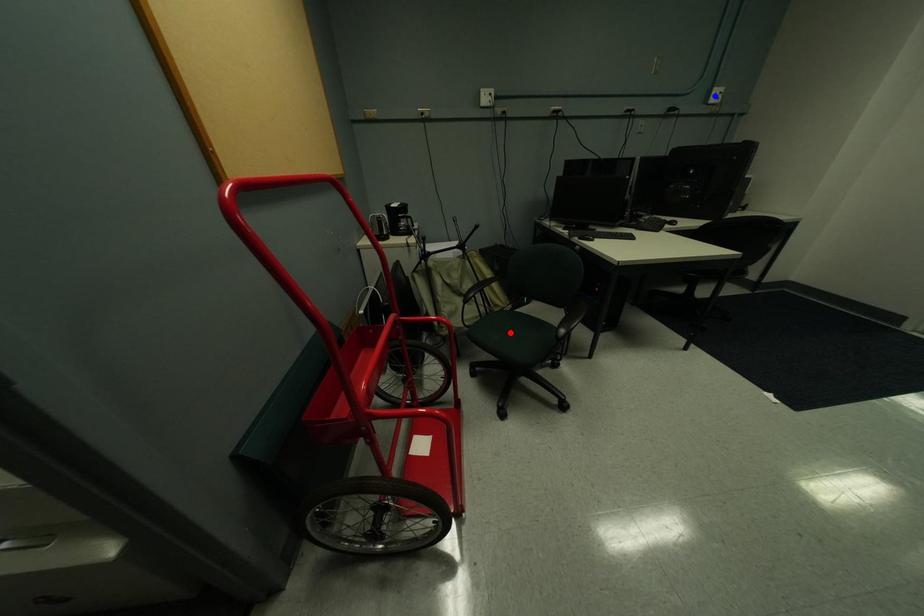
Question: Which of the two points in the image is closer to the camera?

Choices:
 (A) Blue point is closer.
 (B) Red point is closer.

Answer: (B)